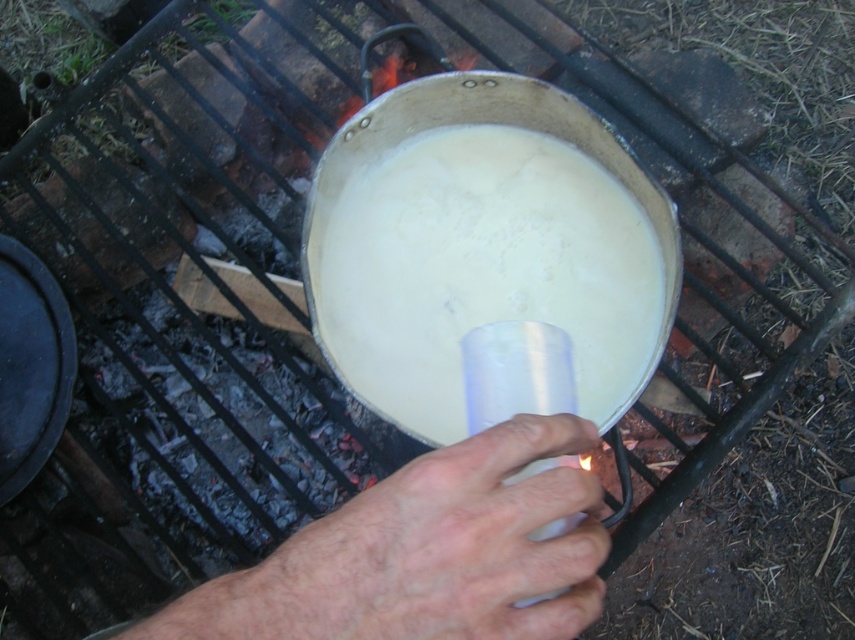
You are standing in front of the campfire cooking setup. There are two points marked in the image, one at coordinates point (492, 225) and another at point (263, 588). Which point is closer to your eyes?

Point (492, 225) is further to the camera than point (263, 588), so the point closer to your eyes is point (263, 588).

You are a chef preparing a dish that requires precise measurements. You have a white matte liquid at center and a dry skin at center in your pot. Which of these two items takes up more space in the pot?

The white matte liquid at center takes up more space in the pot than the dry skin at center because it is bigger.

You are a chef preparing a dish and need to check the consistency of both the white matte liquid at center and the dry skin at center. Which one can you reach first without moving your position?

The white matte liquid at center can be reached first because it is closer to you than the dry skin at center.